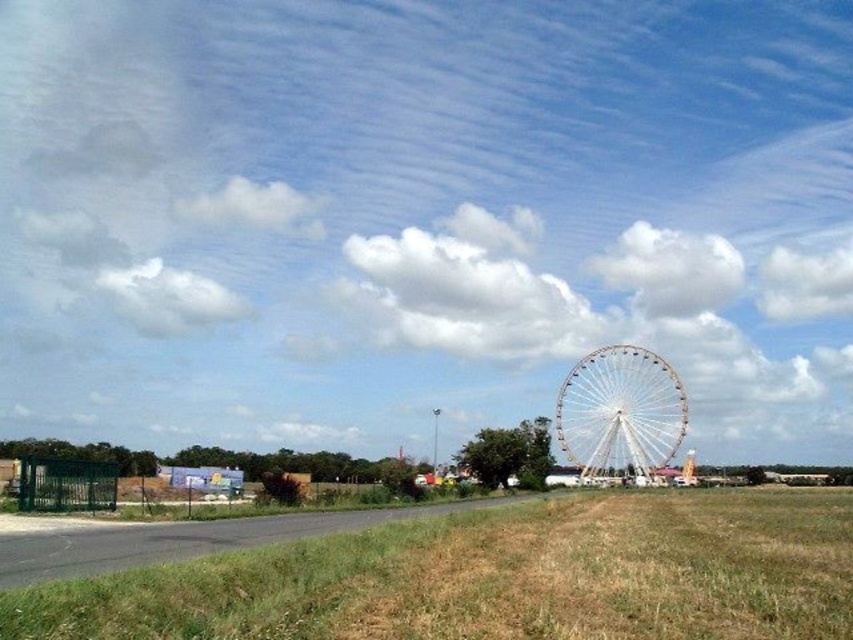
Between point (555, 573) and point (564, 406), which one is positioned behind?

Positioned behind is point (564, 406).

How much distance is there between dry grass at lower center and white metallic ferris wheel at center?

A distance of 1012.94 feet exists between dry grass at lower center and white metallic ferris wheel at center.

Between point (523, 593) and point (656, 355), which one is positioned behind?

Point (656, 355)

Find the location of a particular element. The image size is (853, 640). dry grass at lower center is located at coordinates (496, 577).